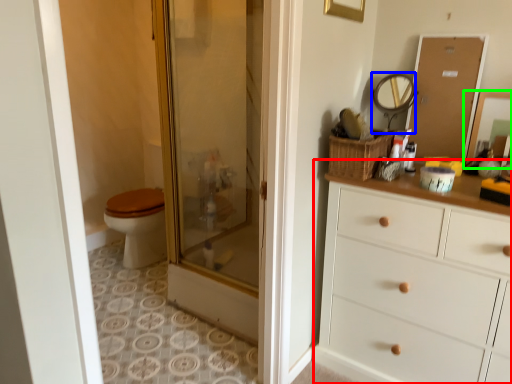
Question: Based on their relative distances, which object is nearer to chest of drawers (highlighted by a red box)? Choose from mirror (highlighted by a blue box) and mirror (highlighted by a green box).

Choices:
 (A) mirror
 (B) mirror

Answer: (B)